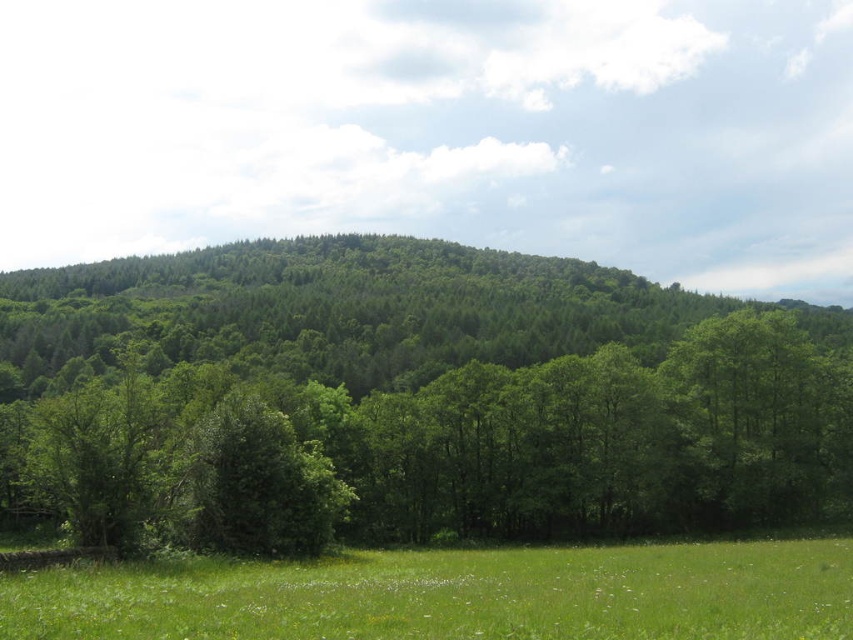
You are a hiker standing on the green grassy field at lower center and want to reach the top of the green leafy tree at center. Which direction should you move to get closer to the tree?

Since the green grassy field at lower center is behind the green leafy tree at center, you are already behind the tree. To get closer to the tree, you should move forward towards it from your current position on the green grassy field at lower center.

Consider the image. You are a gardener planning to plant a new flower bed. You see the green leafy tree at center and the green grassy field at lower center. Which area would be better for planting flowers that require full sunlight?

The green grassy field at lower center would be better for planting flowers that require full sunlight because the green leafy tree at center is positioned over it, which may cast shade and reduce sunlight exposure.

From the picture: You are a hiker standing on the green grassy field at lower center. Looking towards the green leafy tree at center, how does the height of the tree compare to the grassy field you are standing on?

The green leafy tree at center is much taller than the green grassy field at lower center.